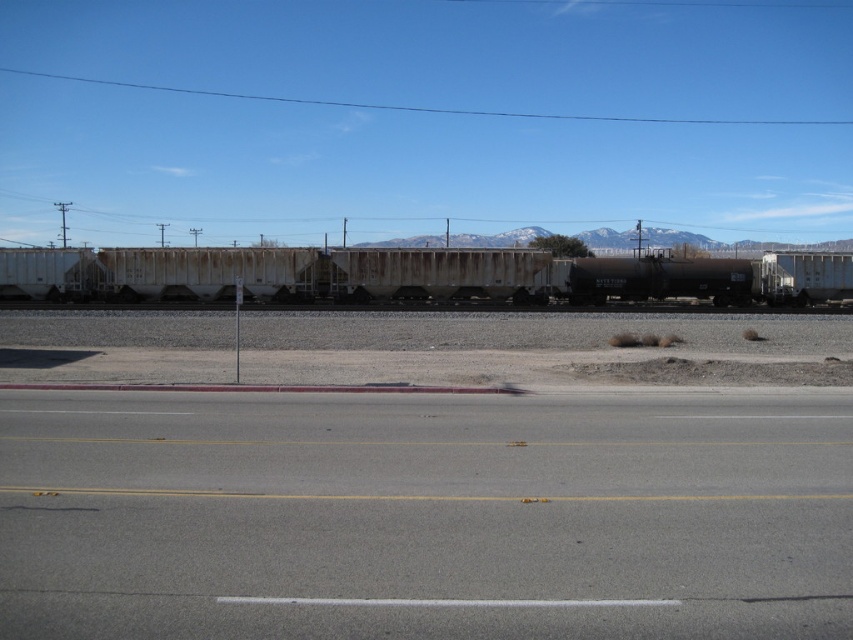
Can you confirm if gray asphalt highway at center is bigger than rusty metal train car at center?

Incorrect, gray asphalt highway at center is not larger than rusty metal train car at center.

Can you confirm if gray asphalt highway at center is positioned to the right of rusty metal train car at center?

Yes, gray asphalt highway at center is to the right of rusty metal train car at center.

At what (x,y) coordinates should I click in order to perform the action: click on gray asphalt highway at center. Please return your answer as a coordinate pair (x, y). The image size is (853, 640). Looking at the image, I should click on (425, 515).